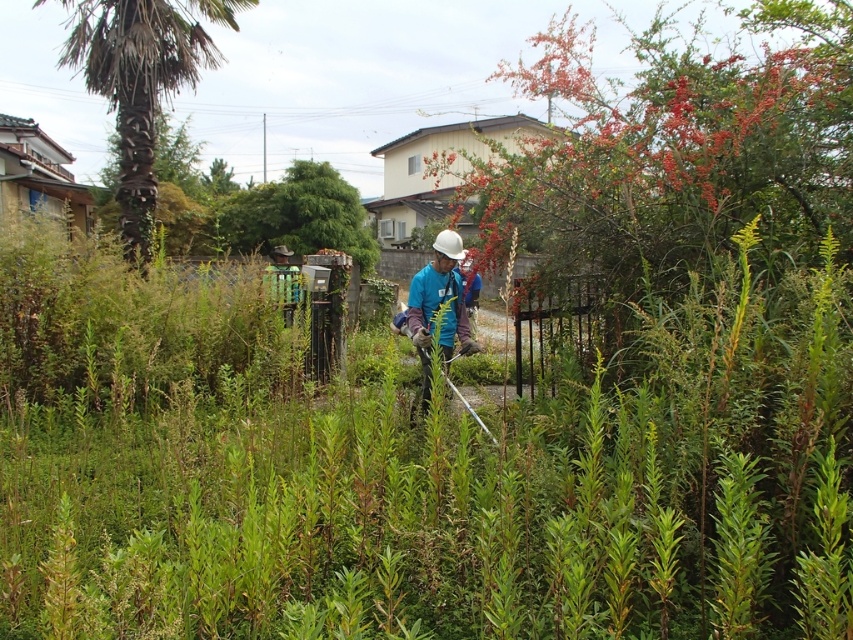
Question: Which point is farther to the camera?

Choices:
 (A) (164, 1)
 (B) (436, 264)

Answer: (A)

Question: Is green leafy palm at left closer to the viewer compared to blue fabric at center?

Choices:
 (A) yes
 (B) no

Answer: (B)

Question: Can you confirm if green leafy palm at left is positioned to the right of blue fabric at center?

Choices:
 (A) no
 (B) yes

Answer: (A)

Question: Which object appears closest to the camera in this image?

Choices:
 (A) green leafy palm at left
 (B) blue fabric at center

Answer: (B)

Question: In this image, where is green leafy palm at left located relative to blue fabric at center?

Choices:
 (A) left
 (B) right

Answer: (A)